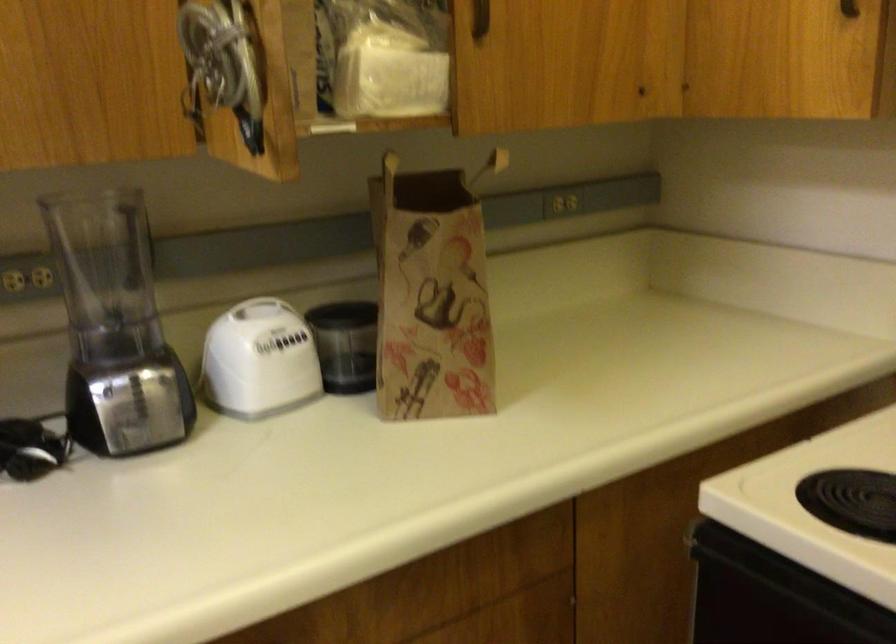
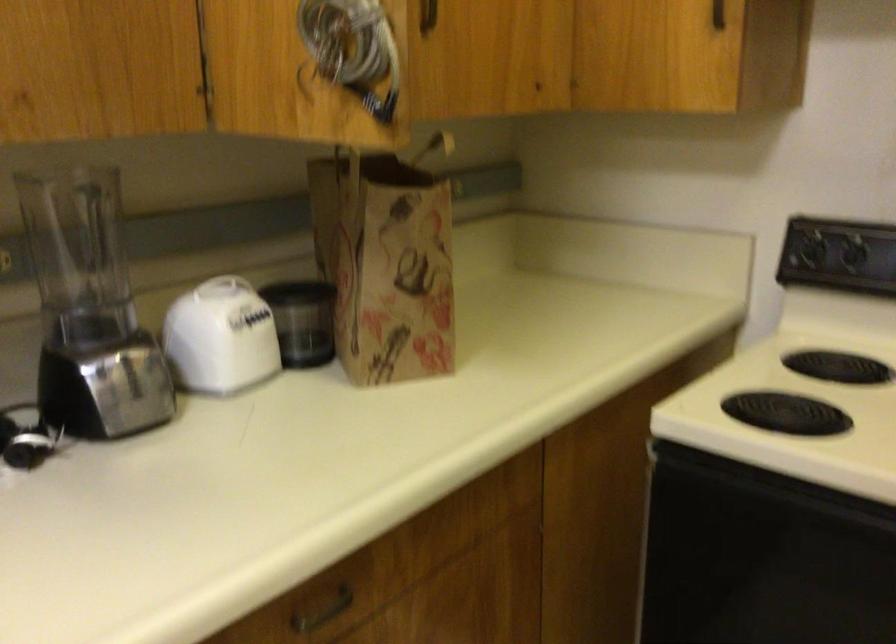
Question: The images are taken continuously from a first-person perspective. In which direction is your viewpoint rotating?

Choices:
 (A) Left
 (B) Right
 (C) Up
 (D) Down

Answer: (B)